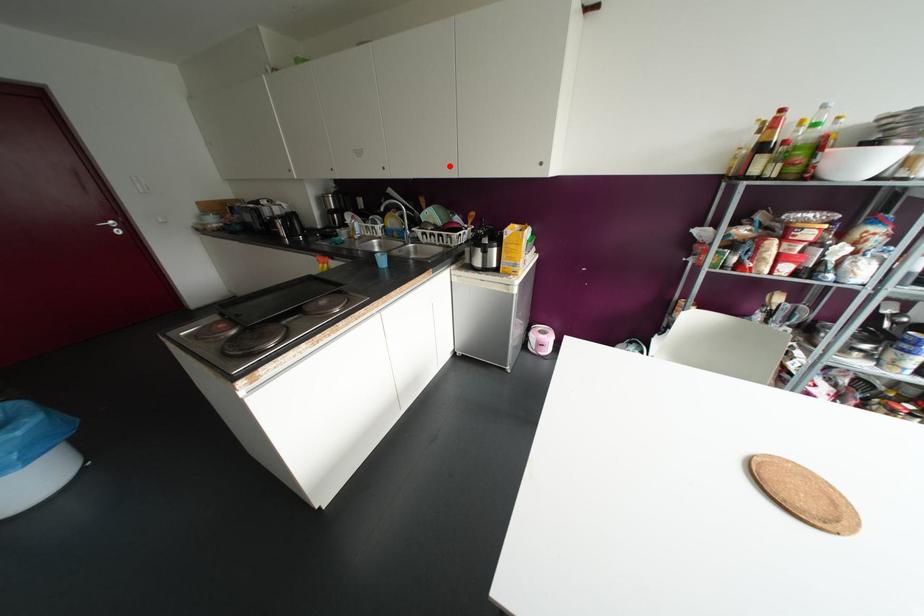
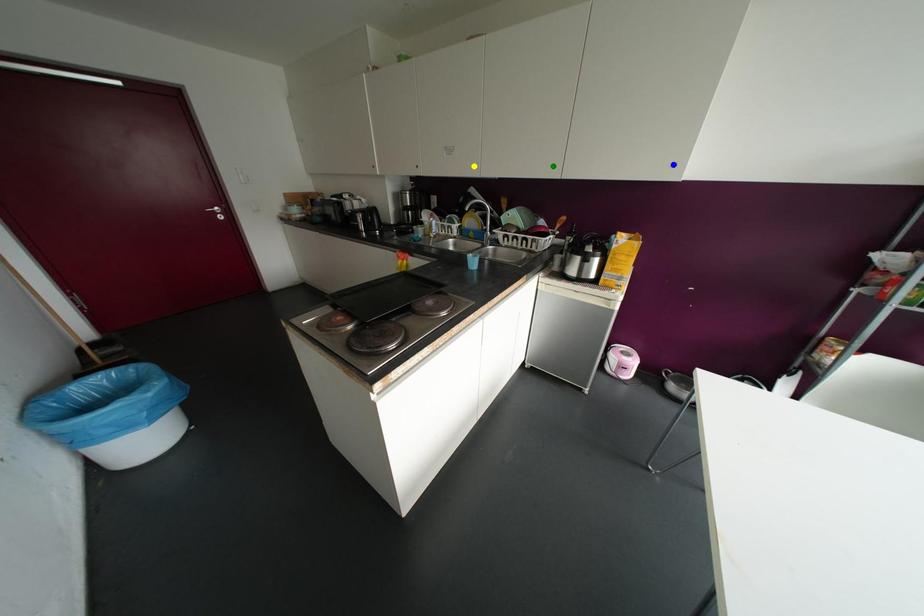
Question: I am providing you with two images of the same scene from different viewpoints. A red point is marked on the first image. You are given multiple points on the second image. Can you choose the point in image 2 that corresponds to the point in image 1?

Choices:
 (A) yellow point
 (B) blue point
 (C) green point

Answer: (C)